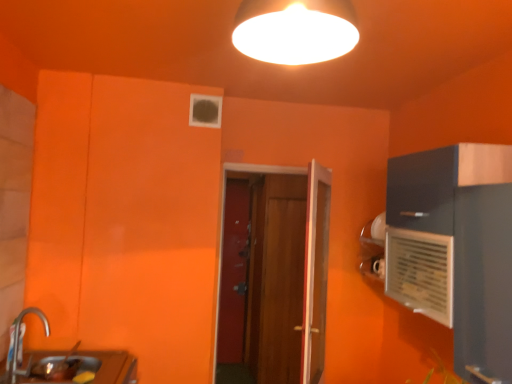
Question: Can we say brushed metal faucet at lower left lies outside smooth wooden door at center, which is the 3th door from front to back?

Choices:
 (A) no
 (B) yes

Answer: (B)

Question: Is there a large distance between brushed metal faucet at lower left and smooth wooden door at center, placed as the 1th door when sorted from back to front?

Choices:
 (A) yes
 (B) no

Answer: (A)

Question: Is brushed metal faucet at lower left positioned with its back to smooth wooden door at center, which is the 3th door from front to back?

Choices:
 (A) no
 (B) yes

Answer: (A)

Question: Does brushed metal faucet at lower left have a lesser width compared to smooth wooden door at center, which is the 3th door from front to back?

Choices:
 (A) no
 (B) yes

Answer: (A)

Question: Is brushed metal faucet at lower left closer to camera compared to smooth wooden door at center, which is the 3th door from front to back?

Choices:
 (A) yes
 (B) no

Answer: (A)

Question: Considering the relative sizes of brushed metal faucet at lower left and smooth wooden door at center, placed as the 1th door when sorted from back to front, in the image provided, is brushed metal faucet at lower left taller than smooth wooden door at center, placed as the 1th door when sorted from back to front,?

Choices:
 (A) yes
 (B) no

Answer: (B)

Question: Does smooth wooden door at center, which is the 3th door from front to back, have a larger size compared to brushed metal faucet at lower left?

Choices:
 (A) yes
 (B) no

Answer: (A)

Question: Can you confirm if smooth wooden door at center, placed as the 1th door when sorted from back to front, is shorter than brushed metal faucet at lower left?

Choices:
 (A) no
 (B) yes

Answer: (A)

Question: Is smooth wooden door at center, placed as the 1th door when sorted from back to front, in front of brushed metal faucet at lower left?

Choices:
 (A) no
 (B) yes

Answer: (A)

Question: Could you tell me if smooth wooden door at center, which is the 3th door from front to back, is facing brushed metal faucet at lower left?

Choices:
 (A) no
 (B) yes

Answer: (A)

Question: Is smooth wooden door at center, placed as the 1th door when sorted from back to front, positioned behind brushed metal faucet at lower left?

Choices:
 (A) yes
 (B) no

Answer: (A)

Question: Is smooth wooden door at center, which is the 3th door from front to back, smaller than brushed metal faucet at lower left?

Choices:
 (A) no
 (B) yes

Answer: (A)

Question: Does brushed metal faucet at lower left turn towards wooden door at center, placed as the 3th door when sorted from back to front?

Choices:
 (A) no
 (B) yes

Answer: (A)